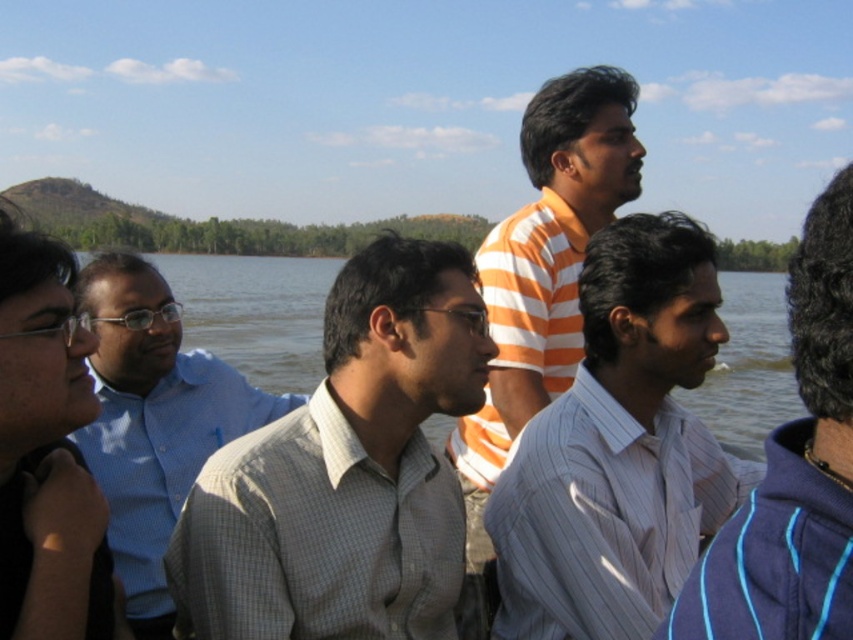
Question: Which point is closer to the camera?

Choices:
 (A) striped cotton shirt at right
 (B) light gray checkered shirt at center
 (C) orange striped shirt at center

Answer: (A)

Question: Is white striped shirt at center above blue water at center?

Choices:
 (A) yes
 (B) no

Answer: (B)

Question: Does light gray checkered shirt at center have a smaller size compared to striped cotton shirt at right?

Choices:
 (A) yes
 (B) no

Answer: (A)

Question: Considering the real-world distances, which object is closest to the white striped shirt at center?

Choices:
 (A) light gray checkered shirt at center
 (B) blue water at center

Answer: (A)

Question: Can you confirm if white striped shirt at center is wider than blue checkered shirt at left?

Choices:
 (A) yes
 (B) no

Answer: (A)

Question: Which of the following is the farthest from the observer?

Choices:
 (A) 137,632
 (B) 494,564

Answer: (B)